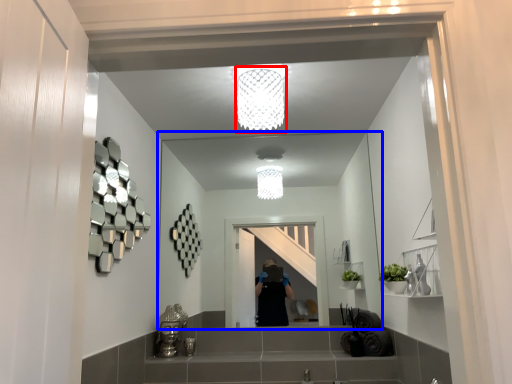
Question: Which object is closer to the camera taking this photo, light fixture (highlighted by a red box) or mirror (highlighted by a blue box)?

Choices:
 (A) light fixture
 (B) mirror

Answer: (A)